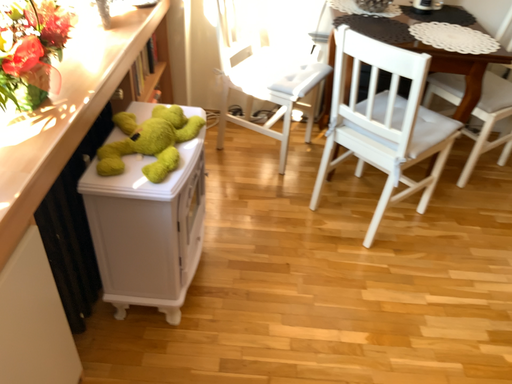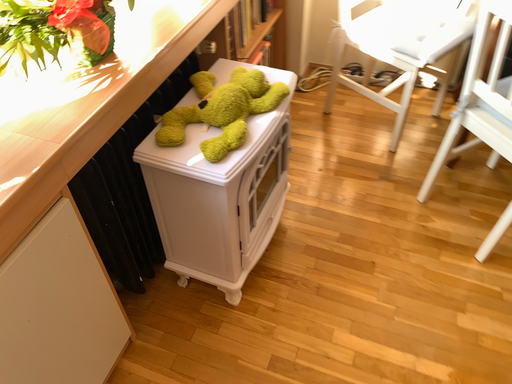
Question: Which way did the camera rotate in the video?

Choices:
 (A) rotated left
 (B) rotated right

Answer: (A)